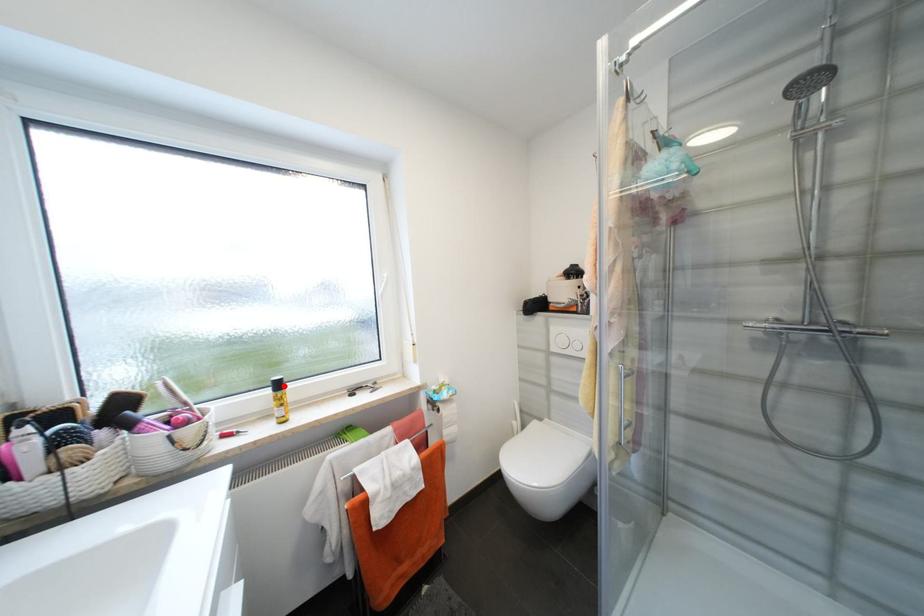
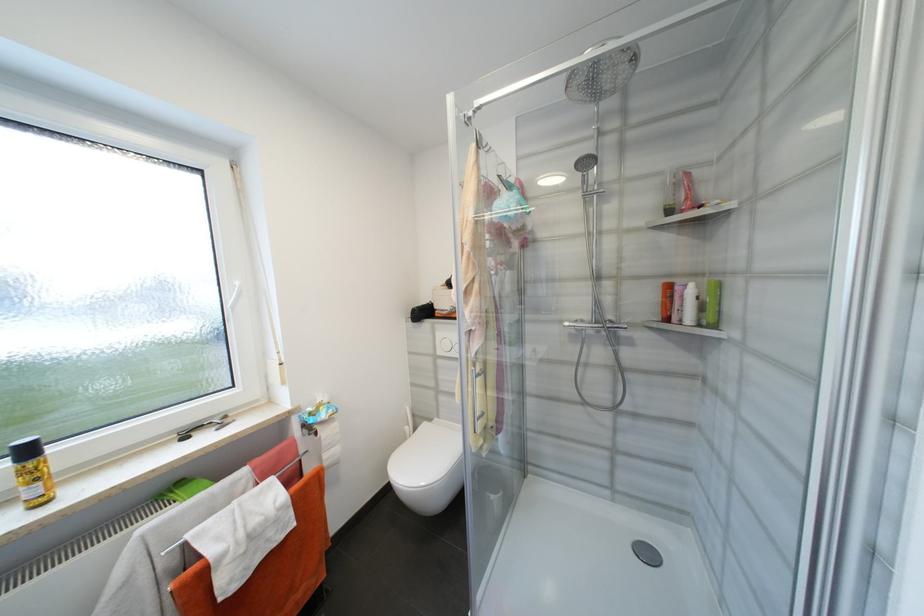
Question: I am providing you with two images of the same scene from different viewpoints. A red point is marked on the first image. Can you still see the location of the red point in image 2?

Choices:
 (A) Yes
 (B) No

Answer: (A)